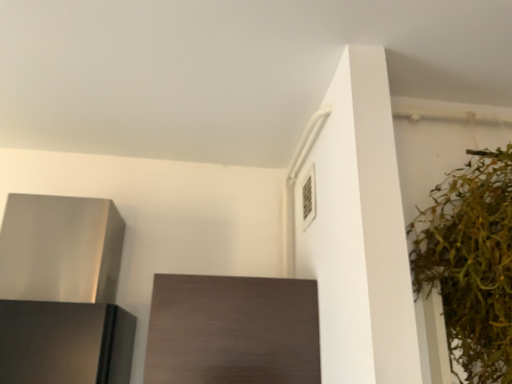
Question: From the image's perspective, would you say satin silver range hood at left is positioned over green leafy plant at right?

Choices:
 (A) yes
 (B) no

Answer: (B)

Question: Is satin silver range hood at left positioned behind green leafy plant at right?

Choices:
 (A) no
 (B) yes

Answer: (B)

Question: Does satin silver range hood at left have a greater height compared to green leafy plant at right?

Choices:
 (A) yes
 (B) no

Answer: (B)

Question: From a real-world perspective, is satin silver range hood at left positioned over green leafy plant at right based on gravity?

Choices:
 (A) yes
 (B) no

Answer: (B)

Question: Could you tell me if satin silver range hood at left is turned towards green leafy plant at right?

Choices:
 (A) yes
 (B) no

Answer: (B)

Question: Does satin silver range hood at left have a larger size compared to green leafy plant at right?

Choices:
 (A) yes
 (B) no

Answer: (B)

Question: From a real-world perspective, is dark wood cabinet at center positioned under green leafy plant at right based on gravity?

Choices:
 (A) yes
 (B) no

Answer: (A)

Question: Is dark wood cabinet at center in contact with green leafy plant at right?

Choices:
 (A) no
 (B) yes

Answer: (A)

Question: From the image's perspective, would you say dark wood cabinet at center is positioned over green leafy plant at right?

Choices:
 (A) no
 (B) yes

Answer: (A)

Question: Can we say dark wood cabinet at center lies outside green leafy plant at right?

Choices:
 (A) yes
 (B) no

Answer: (A)

Question: Does dark wood cabinet at center come behind green leafy plant at right?

Choices:
 (A) no
 (B) yes

Answer: (B)

Question: Is dark wood cabinet at center facing away from green leafy plant at right?

Choices:
 (A) no
 (B) yes

Answer: (A)

Question: Does dark wood cabinet at center have a greater height compared to satin silver range hood at left?

Choices:
 (A) no
 (B) yes

Answer: (A)